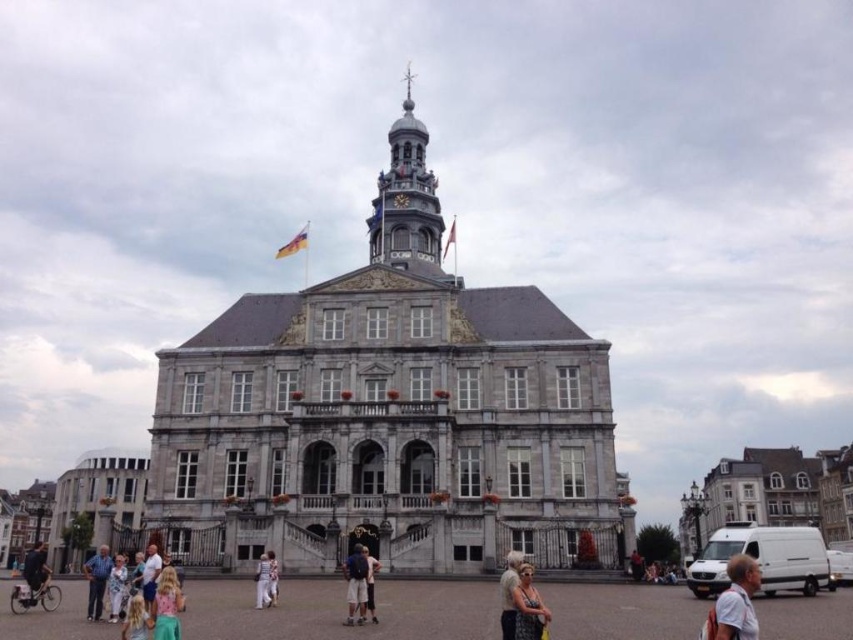
Question: Which point is closer to the camera taking this photo?

Choices:
 (A) (515, 579)
 (B) (527, 595)
 (C) (102, 602)
 (D) (39, 566)

Answer: (B)

Question: Which of these objects is positioned farthest from the white cotton shirt at lower right?

Choices:
 (A) light pink fabric dress at center
 (B) polished brass clock tower at center
 (C) dark blue jeans at lower left
 (D) light brown leather jacket at lower center

Answer: (B)

Question: Is polished brass clock tower at center behind dark gray textured dress at lower center?

Choices:
 (A) yes
 (B) no

Answer: (A)

Question: In this image, where is dark gray textured dress at lower center located relative to dark blue jeans at lower left?

Choices:
 (A) right
 (B) left

Answer: (A)

Question: Does light brown leather jacket at lower center lie behind white cotton dress at center?

Choices:
 (A) yes
 (B) no

Answer: (B)

Question: Which object is the closest to the polished brass clock tower at center?

Choices:
 (A) white cotton dress at center
 (B) light pink fabric dress at center
 (C) light blue denim jeans at lower left
 (D) dark blue jeans at lower left

Answer: (B)